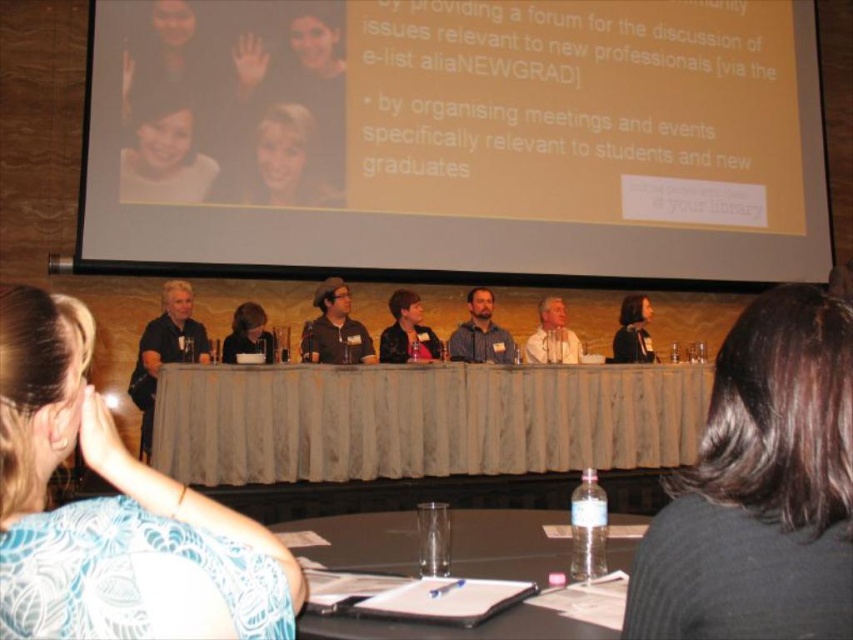
Question: Which point appears farthest from the camera in this image?

Choices:
 (A) (492, 624)
 (B) (386, 388)
 (C) (801, 508)
 (D) (572, 346)

Answer: (D)

Question: In this image, where is clear plastic table at center located relative to light beige shirt at center?

Choices:
 (A) right
 (B) left

Answer: (B)

Question: Among these objects, which one is nearest to the camera?

Choices:
 (A) blue printed blouse at center
 (B) matte black jacket at center
 (C) matte black shirt at center

Answer: (A)

Question: Is gray fabric table at center smaller than clear plastic table at center?

Choices:
 (A) yes
 (B) no

Answer: (B)

Question: Which of the following is the farthest from the observer?

Choices:
 (A) black hair at upper center
 (B) dark brown leather jacket at center
 (C) matte white shirt at upper left

Answer: (C)

Question: Is blue printed blouse at center to the right of black shirt at left from the viewer's perspective?

Choices:
 (A) no
 (B) yes

Answer: (B)